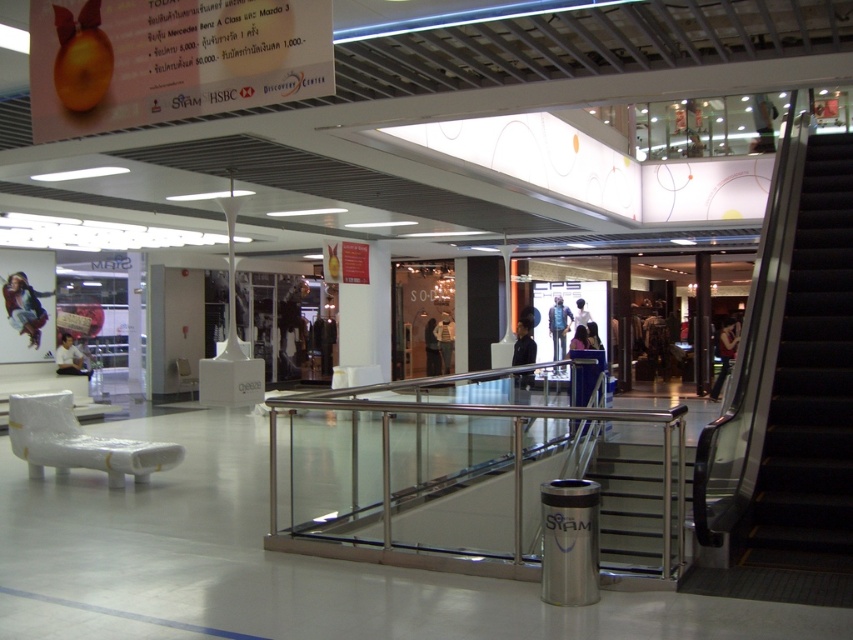
Question: Which object is farther from the camera taking this photo?

Choices:
 (A) white cotton shirt at center
 (B) white shirt at center
 (C) denim jacket at center

Answer: (A)

Question: Which of these objects is positioned farthest from the black rubber stairs at right?

Choices:
 (A) stainless steel railing at center
 (B) dark blue jeans at center
 (C) dark blue jacket at center

Answer: (B)

Question: Which object appears farthest from the camera in this image?

Choices:
 (A) denim jacket at center
 (B) dark blue jeans at center
 (C) matte black jacket at left
 (D) white cotton shirt at center

Answer: (D)

Question: Is black rubber stairs at right bigger than silver metallic stair at lower right?

Choices:
 (A) no
 (B) yes

Answer: (B)

Question: Is silver metallic stair at lower right positioned at the back of white shirt at center?

Choices:
 (A) yes
 (B) no

Answer: (B)

Question: From the image, what is the correct spatial relationship of stainless steel railing at center in relation to white shirt at left?

Choices:
 (A) above
 (B) below

Answer: (B)